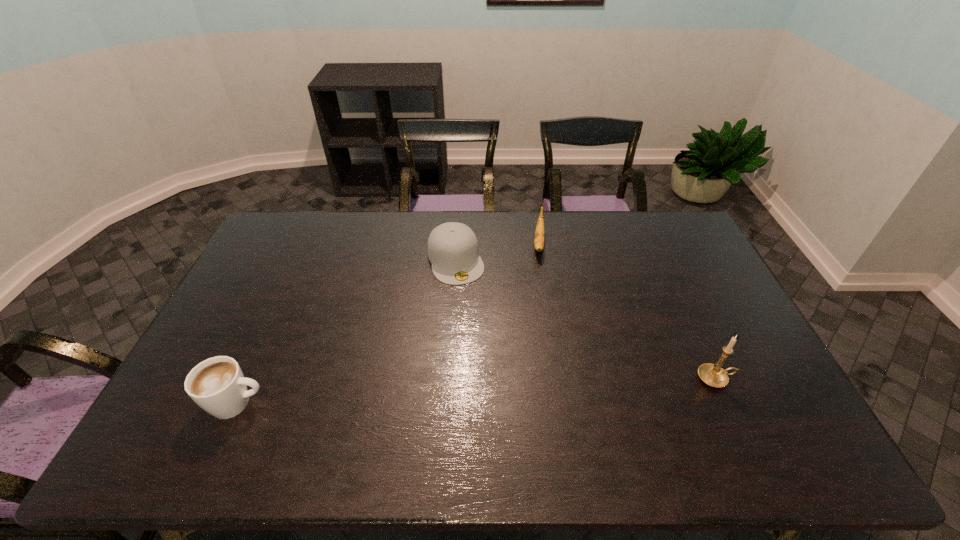
This screenshot has height=540, width=960. I want to click on vacant region that satisfies the following two spatial constraints: 1. on the front side of the third object from right to left; 2. on the handle side of the tallest object, so click(x=448, y=379).

This screenshot has width=960, height=540. In order to click on free space in the image that satisfies the following two spatial constraints: 1. on the front side of the candle holder; 2. on the handle side of the second object from left to right in this screenshot , I will do `click(448, 379)`.